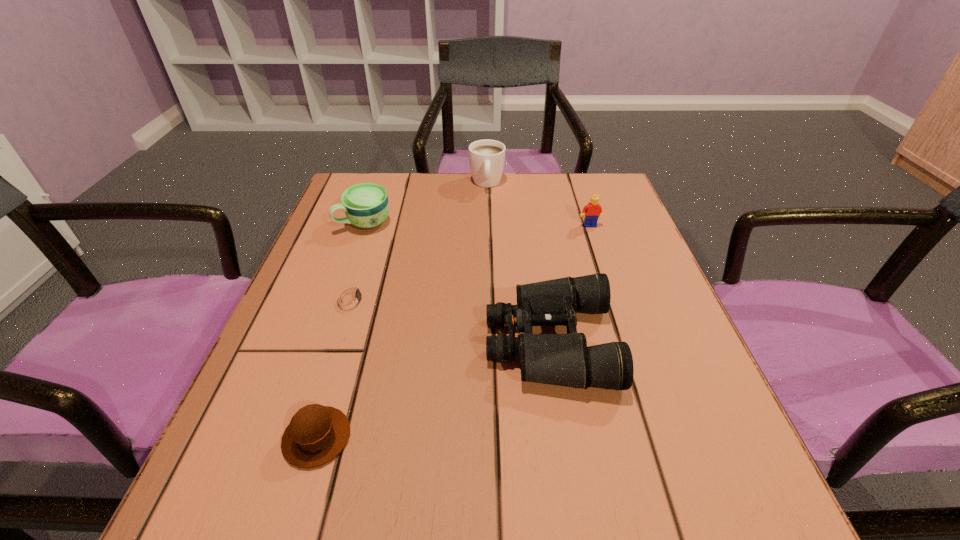
I want to click on free space located on the right of the cup, so click(537, 223).

Where is `blank space located through the eyepieces of the binoculars`? This screenshot has height=540, width=960. blank space located through the eyepieces of the binoculars is located at coordinates (441, 342).

The height and width of the screenshot is (540, 960). I want to click on free spot located through the eyepieces of the binoculars, so click(457, 342).

I want to click on vacant space located through the eyepieces of the binoculars, so click(x=310, y=342).

Where is `vacant area situated on the right of the nearest object`? vacant area situated on the right of the nearest object is located at coordinates (398, 437).

You are a GUI agent. You are given a task and a screenshot of the screen. Output one action in this format:
    pyautogui.click(x=<x>, y=<y>)
    Task: Click on the free space located on the face of the shortest object
    This screenshot has width=960, height=540.
    Given the screenshot: What is the action you would take?
    pyautogui.click(x=401, y=299)

The width and height of the screenshot is (960, 540). I want to click on cappuccino located at the far edge, so click(x=486, y=157).

At what (x,y) coordinates should I click in order to perform the action: click on cup at the far edge. Please return your answer as a coordinate pair (x, y). The image size is (960, 540). Looking at the image, I should click on 366,205.

At what (x,y) coordinates should I click in order to perform the action: click on cup that is positioned at the left edge. Please return your answer as a coordinate pair (x, y). The image size is (960, 540). Looking at the image, I should click on (366, 205).

Locate an element on the screen. This screenshot has width=960, height=540. muffin present at the left edge is located at coordinates (316, 434).